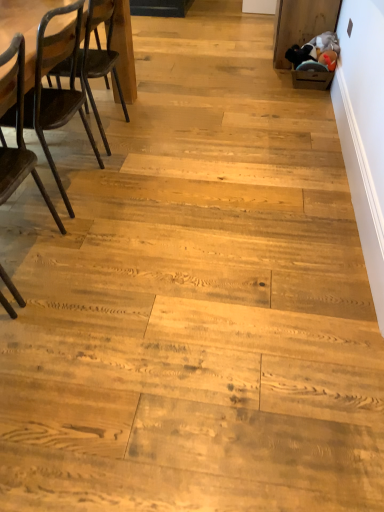
The height and width of the screenshot is (512, 384). Identify the location of vacant area that is in front of dark brown wood table at left. (110, 168).